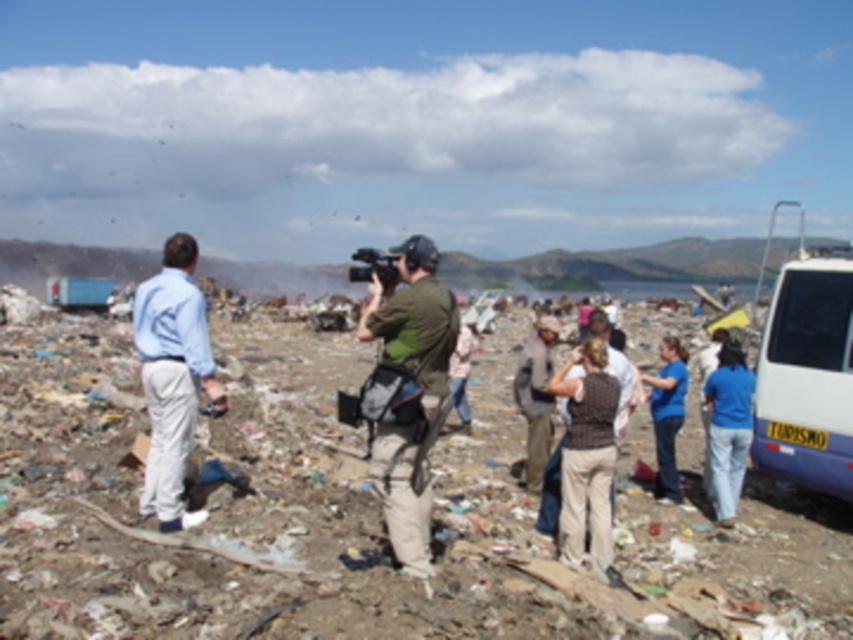
You are standing at the point labeled point (x=842, y=288) and want to walk to the point labeled point (x=666, y=369). Which direction should you walk to get closer to your destination?

You should walk away from the camera because point (x=666, y=369) is further from the camera than point (x=842, y=288).

You are a photographer trying to take a picture of the brown knitted vest at center. The green fabric camera at center is in your way. Can you move the camera down to get a clear shot of the vest?

Yes, since the green fabric camera at center is located above the brown knitted vest at center, moving the camera down would allow you to capture the vest without obstruction.

You are a photographer trying to capture a clear shot of the brown knitted vest at center without the green fabric camera at center blocking it. Since both are at center, can you move the camera to your right to frame the vest better?

The green fabric camera at center is to the left of brown knitted vest at center, so moving the camera to your right would position it away from the vest, allowing a clearer shot without obstruction.